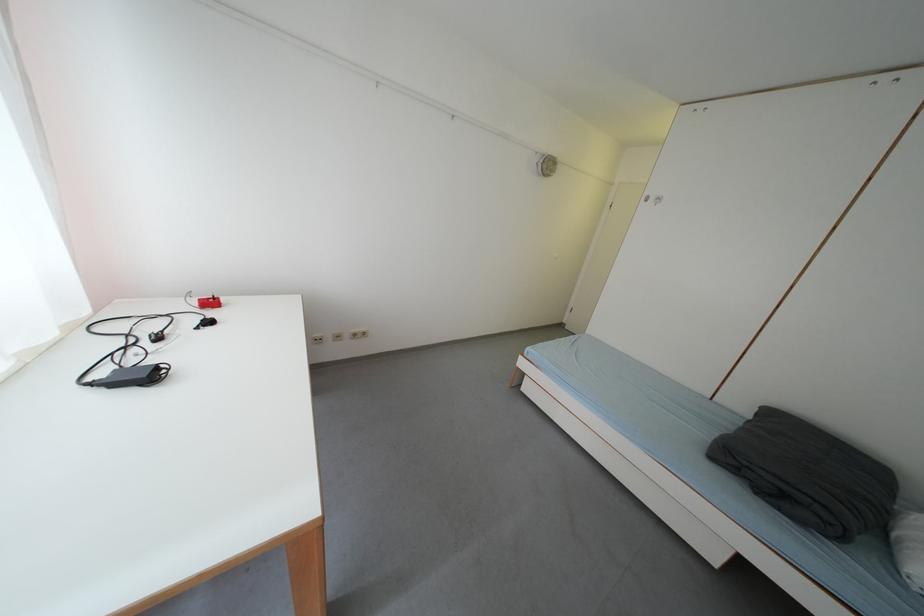
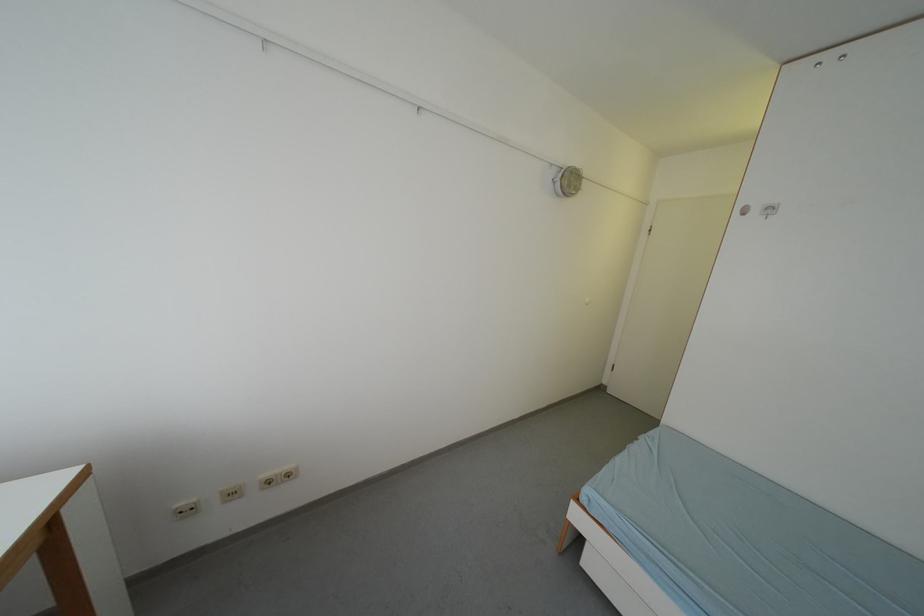
Find the pixel in the second image that matches the point at 556,169 in the first image.

(578, 185)